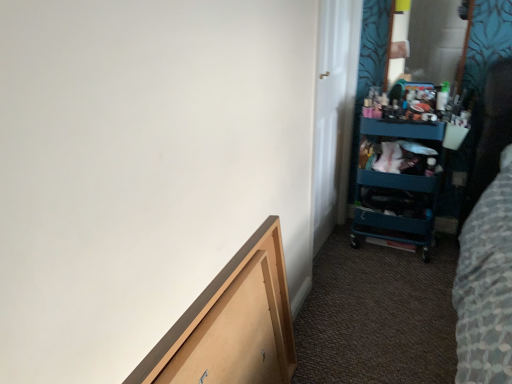
Question: From their relative heights in the image, would you say wooden drawer at lower left is taller or shorter than white glossy door at upper right?

Choices:
 (A) tall
 (B) short

Answer: (B)

Question: Relative to white glossy door at upper right, is wooden drawer at lower left in front or behind?

Choices:
 (A) behind
 (B) front

Answer: (B)

Question: Which object is the farthest from the wooden drawer at lower left?

Choices:
 (A) teal plastic cart at right
 (B) white glossy door at upper right

Answer: (A)

Question: Which is farther from the teal plastic cart at right?

Choices:
 (A) wooden drawer at lower left
 (B) white glossy door at upper right

Answer: (A)